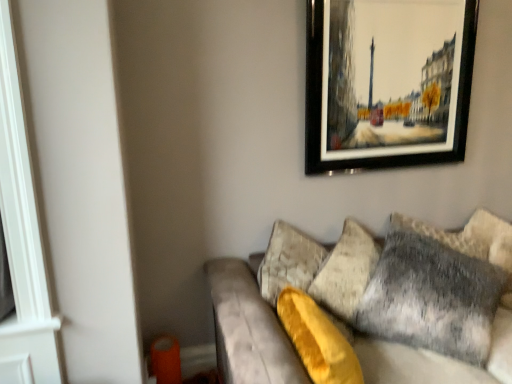
Question: Can you confirm if black-framed painting at upper right is positioned to the left of gray furry pillow at right?

Choices:
 (A) yes
 (B) no

Answer: (A)

Question: Does black-framed painting at upper right have a lesser height compared to gray furry pillow at right?

Choices:
 (A) yes
 (B) no

Answer: (B)

Question: Considering the relative sizes of black-framed painting at upper right and gray furry pillow at right in the image provided, is black-framed painting at upper right thinner than gray furry pillow at right?

Choices:
 (A) no
 (B) yes

Answer: (B)

Question: From a real-world perspective, does black-framed painting at upper right sit lower than gray furry pillow at right?

Choices:
 (A) no
 (B) yes

Answer: (A)

Question: Does black-framed painting at upper right touch gray furry pillow at right?

Choices:
 (A) yes
 (B) no

Answer: (B)

Question: Is black-framed painting at upper right smaller than gray furry pillow at right?

Choices:
 (A) yes
 (B) no

Answer: (A)

Question: Does black-framed painting at upper right have a greater width compared to velvet gray couch at lower right?

Choices:
 (A) no
 (B) yes

Answer: (A)

Question: From the image's perspective, is black-framed painting at upper right located above velvet gray couch at lower right?

Choices:
 (A) yes
 (B) no

Answer: (A)

Question: Is black-framed painting at upper right closer to camera compared to velvet gray couch at lower right?

Choices:
 (A) yes
 (B) no

Answer: (B)

Question: Is black-framed painting at upper right next to velvet gray couch at lower right and touching it?

Choices:
 (A) yes
 (B) no

Answer: (B)

Question: Can you confirm if black-framed painting at upper right is positioned to the right of velvet gray couch at lower right?

Choices:
 (A) yes
 (B) no

Answer: (B)

Question: Is black-framed painting at upper right looking in the opposite direction of velvet gray couch at lower right?

Choices:
 (A) yes
 (B) no

Answer: (B)

Question: Can you confirm if gray furry pillow at right is bigger than velvet gray couch at lower right?

Choices:
 (A) no
 (B) yes

Answer: (A)